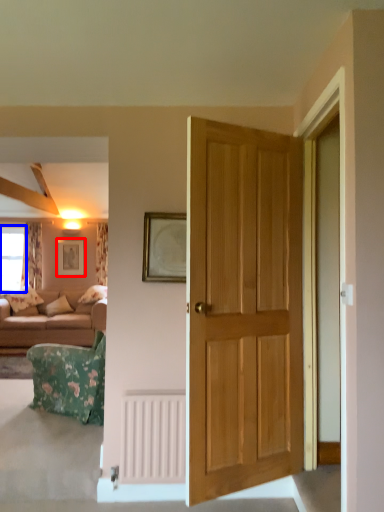
Question: Which object appears farthest to the camera in this image, picture frame (highlighted by a red box) or window (highlighted by a blue box)?

Choices:
 (A) picture frame
 (B) window

Answer: (B)